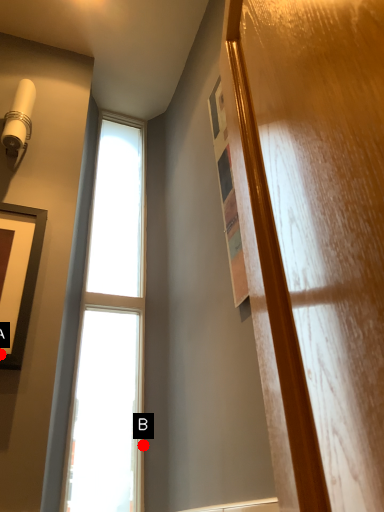
Question: Two points are circled on the image, labeled by A and B beside each circle. Which point is closer to the camera taking this photo?

Choices:
 (A) A is closer
 (B) B is closer

Answer: (A)